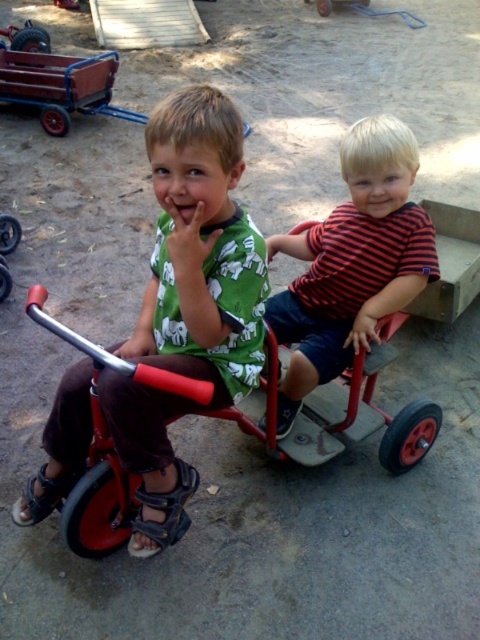
You are a photographer taking a picture of two children sitting on tricycles. You need to position your camera so that the green matte shirt at center and the striped cotton shirt at center are both in frame. Which child should you focus on first if you want to ensure both are visible without moving the camera?

You should focus on the striped cotton shirt at center first because the green matte shirt at center is to the left of it, so by centering the striped cotton shirt, the green matte shirt will naturally be included in the frame to the left.

From the picture: You are a photographer trying to capture a clear photo of the green matte shirt at center and the striped cotton shirt at center. Since both shirts are in the same area, which one should you focus on first to ensure the other remains in the background?

You should focus on the green matte shirt at center first because it is in front of the striped cotton shirt at center, so by focusing on the front shirt, the one behind will naturally stay in the background.